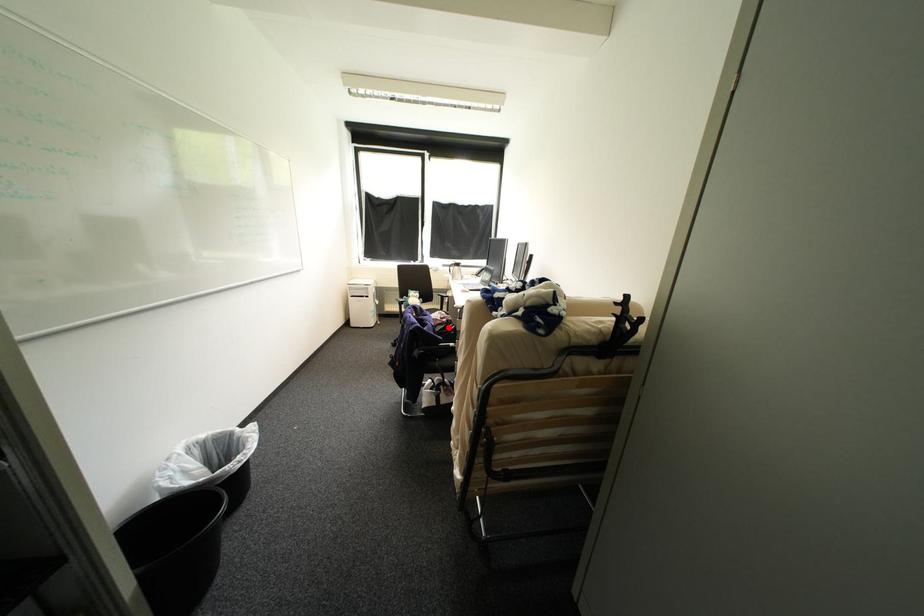
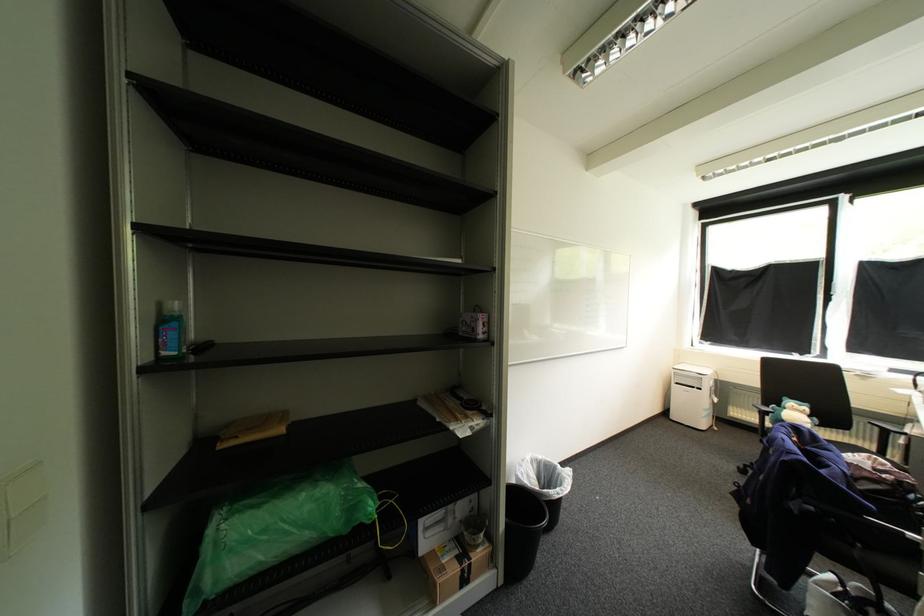
Where in the second image is the point corresponding to the highlighted location from the first image?

(885, 488)